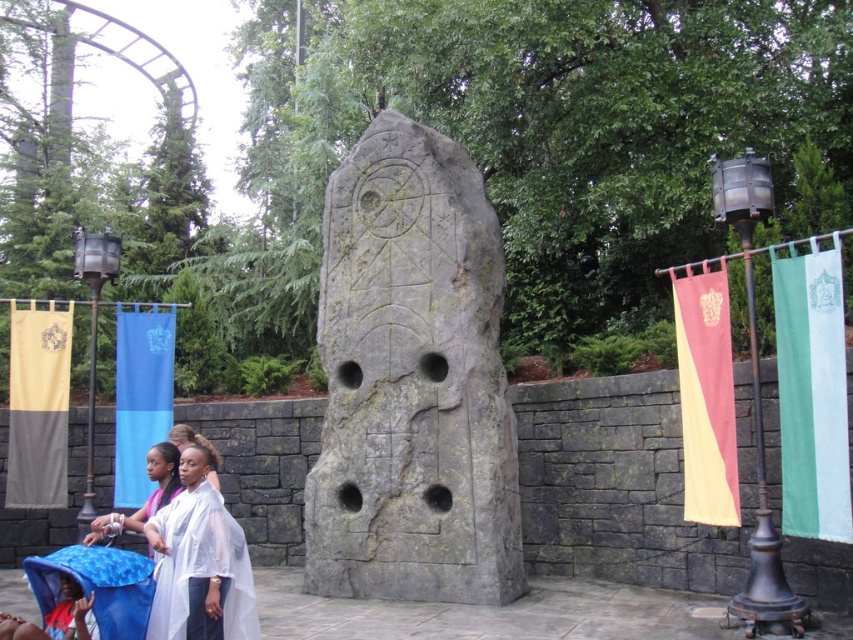
Which of these two, white sheer fabric at lower left or blue fabric banner at left, stands shorter?

white sheer fabric at lower left

Who is taller, white sheer fabric at lower left or blue fabric banner at left?

blue fabric banner at left is taller.

Where is `white sheer fabric at lower left`? The height and width of the screenshot is (640, 853). white sheer fabric at lower left is located at coordinates (199, 563).

Locate an element on the screen. The width and height of the screenshot is (853, 640). white sheer fabric at lower left is located at coordinates (199, 563).

Is gray stone carving at center below gold fabric banner at left?

No.

Measure the distance between point (474,573) and camera.

Point (474,573) and camera are 67.79 feet apart from each other.

Which is behind, point (515, 492) or point (27, 440)?

Point (27, 440)

At what (x,y) coordinates should I click in order to perform the action: click on gray stone carving at center. Please return your answer as a coordinate pair (x, y). Looking at the image, I should click on (412, 381).

Is green fabric banner at right bigger than white sheer fabric at lower left?

No, green fabric banner at right is not bigger than white sheer fabric at lower left.

You are a GUI agent. You are given a task and a screenshot of the screen. Output one action in this format:
    pyautogui.click(x=<x>, y=<y>)
    Task: Click on the green fabric banner at right
    The image size is (853, 640).
    Given the screenshot: What is the action you would take?
    pyautogui.click(x=811, y=394)